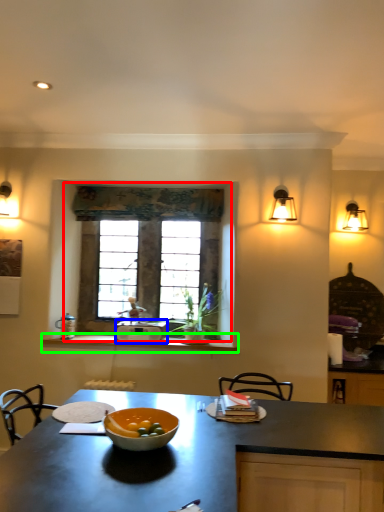
Question: Considering the real-world distances, which object is farthest from window (highlighted by a red box)? kitchen appliance (highlighted by a blue box) or counter (highlighted by a green box)?

Choices:
 (A) kitchen appliance
 (B) counter

Answer: (B)